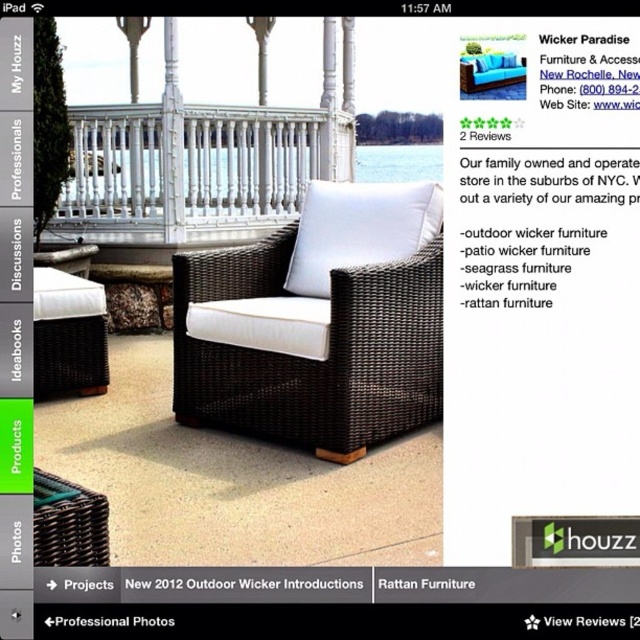
You are designing a small balcony and want to place both the white wicker chair at center and the rattan furniture at center. Which one should you choose if you want the bigger item to be closer to the railing?

The white wicker chair at center is larger than the rattan furniture at center, so you should place the white wicker chair at center closer to the railing if you want the bigger item there.

You are designing a patio layout and want to place the white matte pillow at center and the matte wicker chair at center. If your design requires the pillow to be within 5 feet of the chair, will this placement work?

The distance between the white matte pillow at center and the matte wicker chair at center is 7.07 feet, which exceeds the 5 feet requirement. Therefore, this placement will not meet the design requirement.